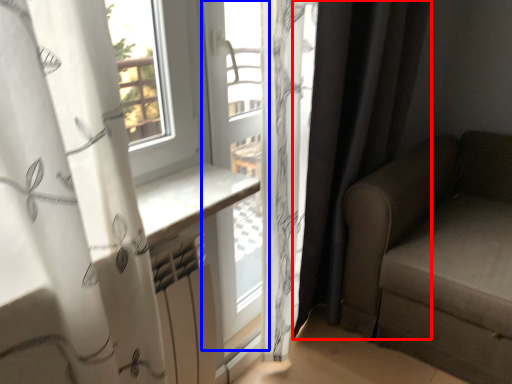
Question: Which point is closer to the camera, curtain (highlighted by a red box) or window frame (highlighted by a blue box)?

Choices:
 (A) curtain
 (B) window frame

Answer: (A)